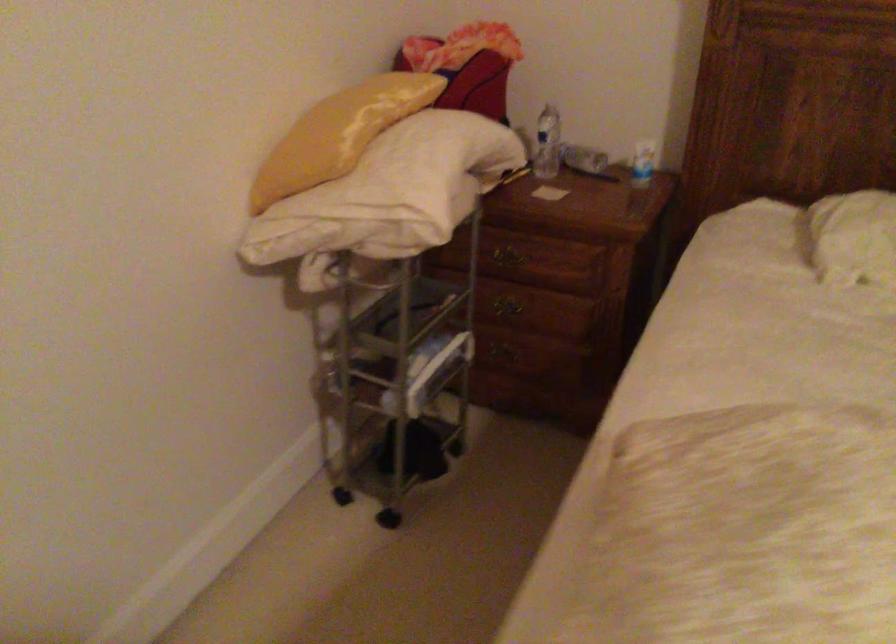
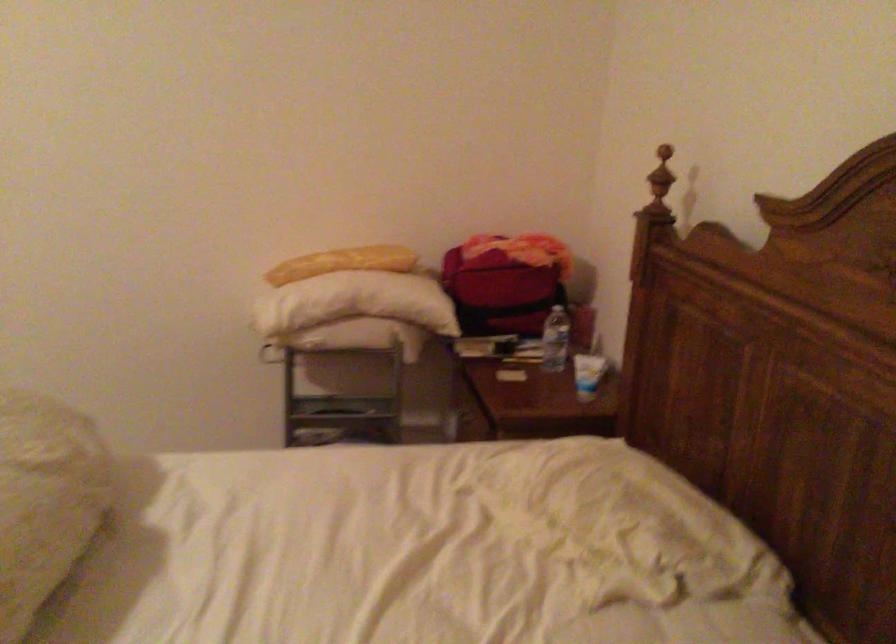
Locate, in the second image, the point that corresponds to pixel 567 140 in the first image.

(556, 339)